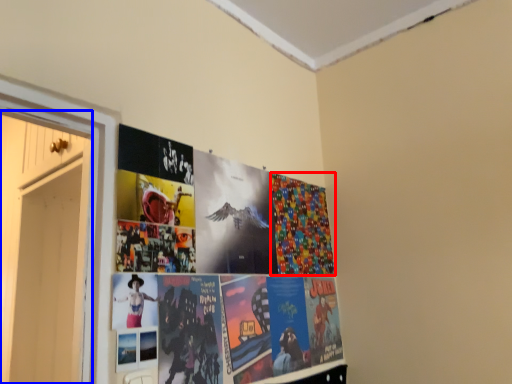
Question: Which of the following is the farthest to the observer, flyer (highlighted by a red box) or door (highlighted by a blue box)?

Choices:
 (A) flyer
 (B) door

Answer: (A)